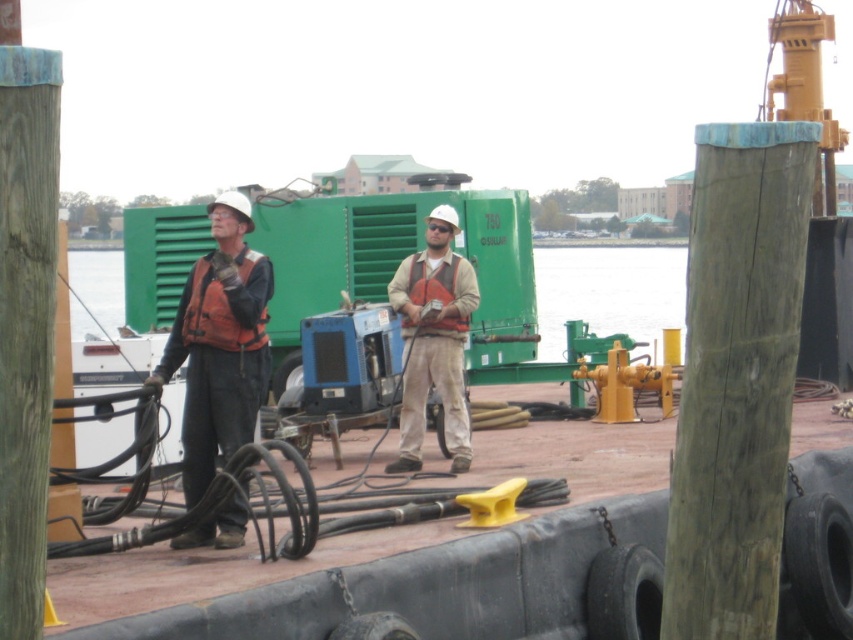
Question: Which of the following is the closest to the observer?

Choices:
 (A) matte orange vest at center
 (B) orange life vest at center

Answer: (B)

Question: In this image, where is orange life vest at center located relative to matte orange vest at center?

Choices:
 (A) right
 (B) left

Answer: (B)

Question: Is orange life vest at center to the left of matte orange vest at center from the viewer's perspective?

Choices:
 (A) no
 (B) yes

Answer: (B)

Question: Does orange life vest at center lie behind matte orange vest at center?

Choices:
 (A) yes
 (B) no

Answer: (B)